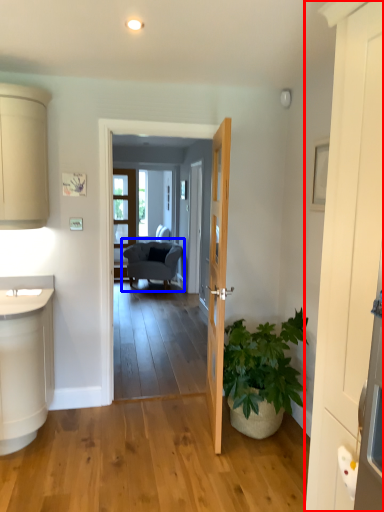
Question: Among these objects, which one is nearest to the camera, door (highlighted by a red box) or chair (highlighted by a blue box)?

Choices:
 (A) door
 (B) chair

Answer: (A)